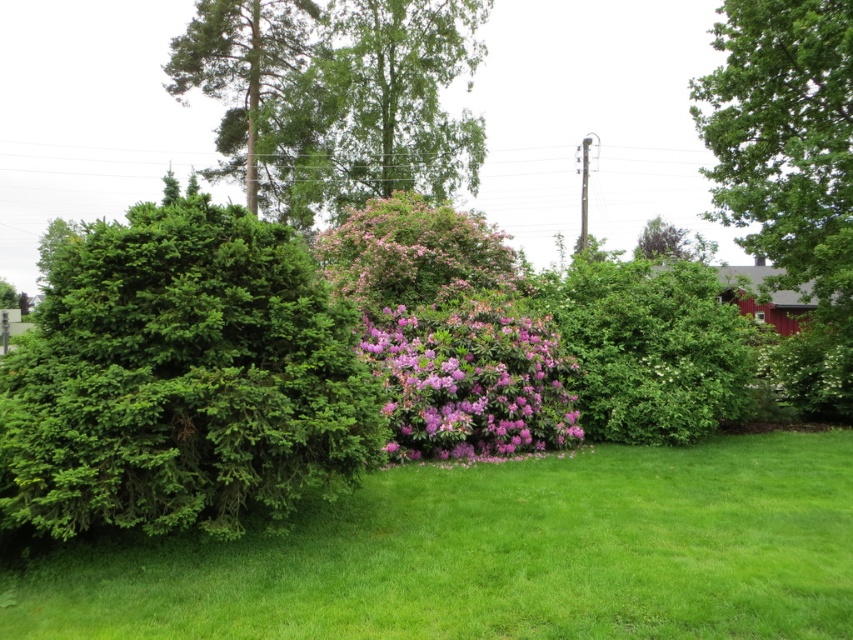
You are planning to place a small garden bench in the garden. The bench requires a space larger than the green textured shrub at left but smaller than the green leafy tree at upper right. Is there enough space between them to place the bench?

The green textured shrub at left is smaller than the green leafy tree at upper right, so there is sufficient space between them to place the bench as it requires a size larger than the shrub but smaller than the tree.

You are planning to place a large garden sculpture between the green textured shrub at left and the green leafy tree at upper right. Based on their widths, which object should you position the sculpture closer to?

The green textured shrub at left might be wider than green leafy tree at upper right, so positioning the sculpture closer to the green textured shrub at left would ensure it is placed near the wider object.

You are standing in the garden and want to take a closer look at both the green leafy hedge at center and the green textured tree at upper left. Which object should you move towards first if you want to reach the one that is nearest to you?

You should move towards the green leafy hedge at center first because it is closer to the viewer than the green textured tree at upper left.